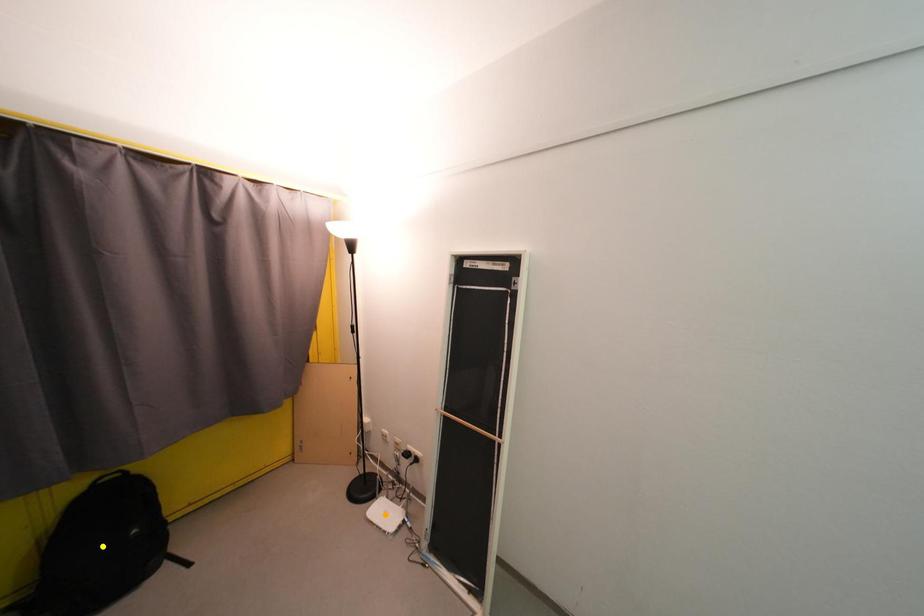
Order these from farthest to nearest:
- orange point
- green point
- yellow point

orange point, green point, yellow point